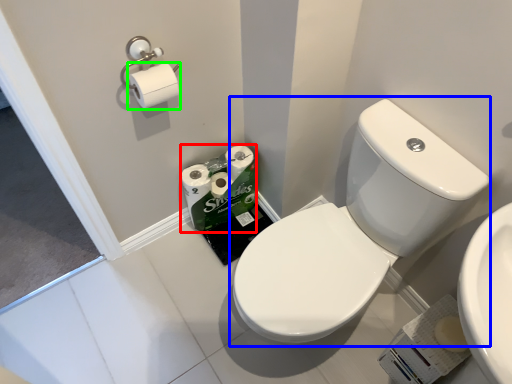
Question: Which object is positioned closest to toilet paper (highlighted by a red box)? Select from sink (highlighted by a blue box) and toilet paper (highlighted by a green box).

Choices:
 (A) sink
 (B) toilet paper

Answer: (B)